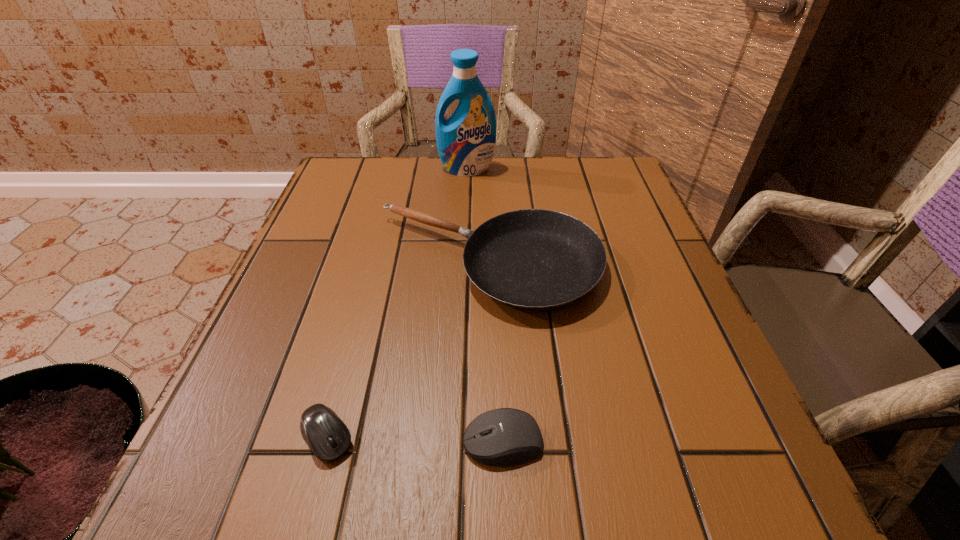
Where is `the farthest object`? The image size is (960, 540). the farthest object is located at coordinates (466, 141).

Where is `the tallest object`? This screenshot has width=960, height=540. the tallest object is located at coordinates (466, 141).

Where is `frying pan`? The height and width of the screenshot is (540, 960). frying pan is located at coordinates (532, 259).

Where is `the second farthest object`? the second farthest object is located at coordinates (532, 259).

Where is `the left computer equipment`? the left computer equipment is located at coordinates (326, 434).

Locate an element on the screen. This screenshot has height=540, width=960. the right computer equipment is located at coordinates (501, 437).

Identify the location of vacant area located 0.270m on the front-facing side of the tallest object. (464, 240).

At what (x,y) coordinates should I click in order to perform the action: click on free space located 0.270m on the front of the frying pan. Please return your answer as a coordinate pair (x, y). The width and height of the screenshot is (960, 540). Looking at the image, I should click on (492, 475).

Find the location of `free location located 0.060m on the right of the left computer equipment`. free location located 0.060m on the right of the left computer equipment is located at coordinates (396, 437).

Where is `blank space located on the left of the right computer equipment`? The height and width of the screenshot is (540, 960). blank space located on the left of the right computer equipment is located at coordinates (351, 442).